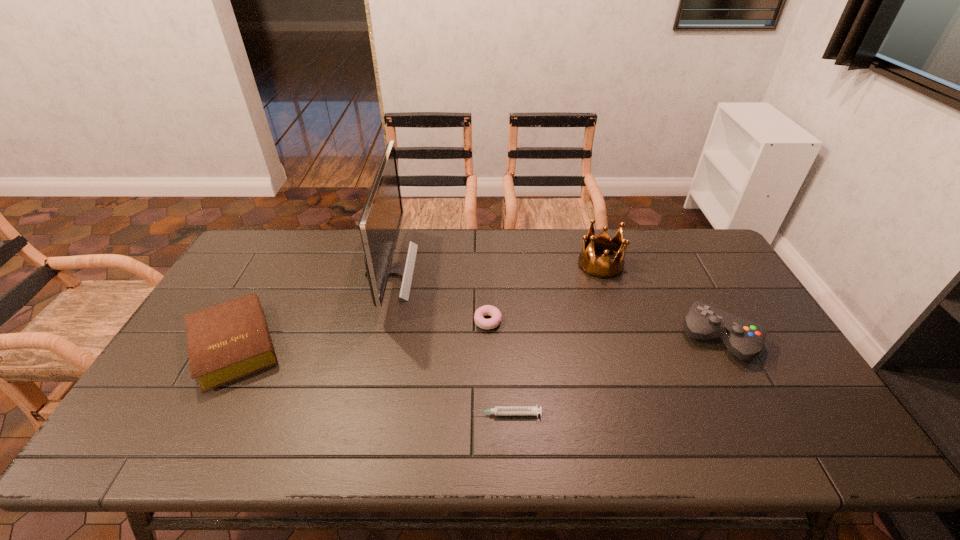
Locate an element on the screen. crown that is at the far edge is located at coordinates (603, 268).

You are a GUI agent. You are given a task and a screenshot of the screen. Output one action in this format:
    pyautogui.click(x=<x>, y=<y>)
    Task: Click on the object located at the left edge
    This screenshot has height=540, width=960.
    Given the screenshot: What is the action you would take?
    pyautogui.click(x=228, y=341)

Image resolution: width=960 pixels, height=540 pixels. Identify the location of object that is at the right edge. (743, 338).

Where is `vacant space at the far edge`? vacant space at the far edge is located at coordinates (479, 249).

In the image, there is a desktop. At what (x,y) coordinates should I click in order to perform the action: click on blank space at the left edge. Please return your answer as a coordinate pair (x, y). The height and width of the screenshot is (540, 960). Looking at the image, I should click on click(x=179, y=403).

In the image, there is a desktop. Identify the location of free region at the right edge. (796, 411).

Where is `empty space that is in between the second shortest object and the crown`? The image size is (960, 540). empty space that is in between the second shortest object and the crown is located at coordinates (544, 293).

Locate an element on the screen. Image resolution: width=960 pixels, height=540 pixels. free area in between the syringe and the second object from left to right is located at coordinates (448, 343).

Where is `vacant space that is in between the doughnut and the nearest object`? The image size is (960, 540). vacant space that is in between the doughnut and the nearest object is located at coordinates (497, 368).

This screenshot has height=540, width=960. Find the location of `vacant area that lies between the second shortest object and the third shortest object`. vacant area that lies between the second shortest object and the third shortest object is located at coordinates (362, 334).